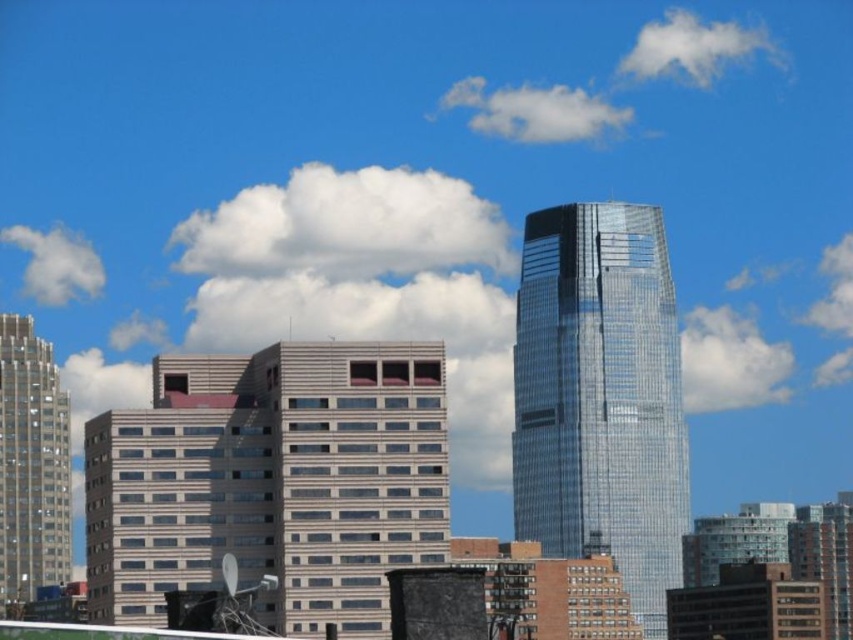
You are an architect analyzing the cityscape. You observe the glassy reflective skyscraper at center and the matte glass skyscraper at left. Based on their positions and the scene description, which skyscraper could potentially accommodate a wider base for structural stability?

The glassy reflective skyscraper at center might be wider than matte glass skyscraper at left, so it could potentially accommodate a wider base for structural stability.

You are a drone operator planning to fly a drone from the beige glass building at center to the glassy reflective skyscraper at center. Based on their positions, will the drone have an unobstructed path? Explain why.

The beige glass building at center is in front of the glassy reflective skyscraper at center, so the drone will have an unobstructed path because the skyscraper is behind the building, meaning there is no obstruction between them.